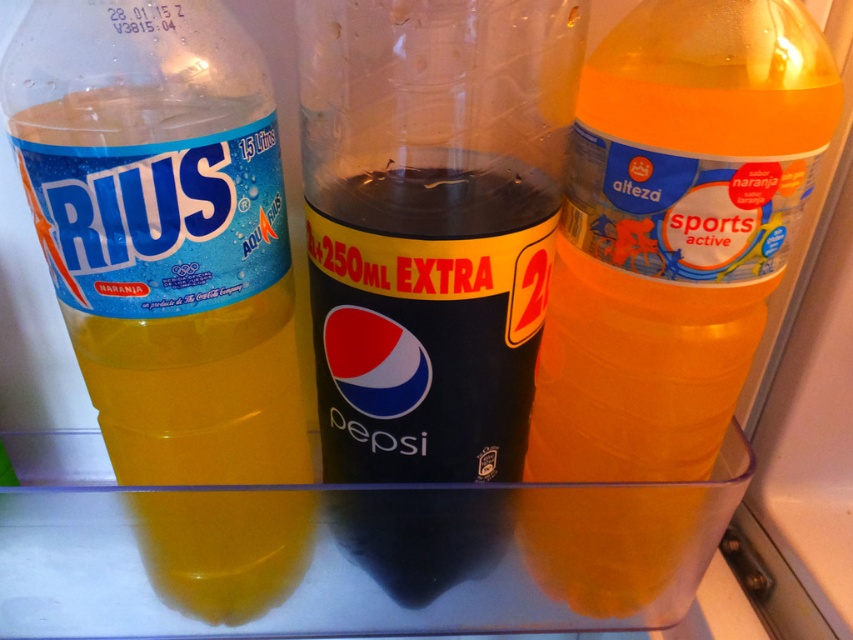
You are organizing the fridge and need to place a new bottle between the translucent plastic bottle at left and the black plastic pepsi bottle at center. Can you fit it there?

The translucent plastic bottle at left is below the black plastic pepsi bottle at center, so there is space between them to fit a new bottle.

You are organizing the fridge and need to stack the translucent plastic bottle at left and the black plastic pepsi bottle at center vertically. Which one should you place at the bottom to ensure stability?

The translucent plastic bottle at left should be placed at the bottom because it is much taller than the black plastic pepsi bottle at center, providing a more stable base.

You are organizing the fridge and need to move the black plastic pepsi bottle at center and the translucent orange bottle at right. Which bottle should you move first if you want to access the one behind them?

You should move the black plastic pepse bottle at center first because it is in front of the translucent orange bottle at right, so removing it first will allow access to the bottle behind.